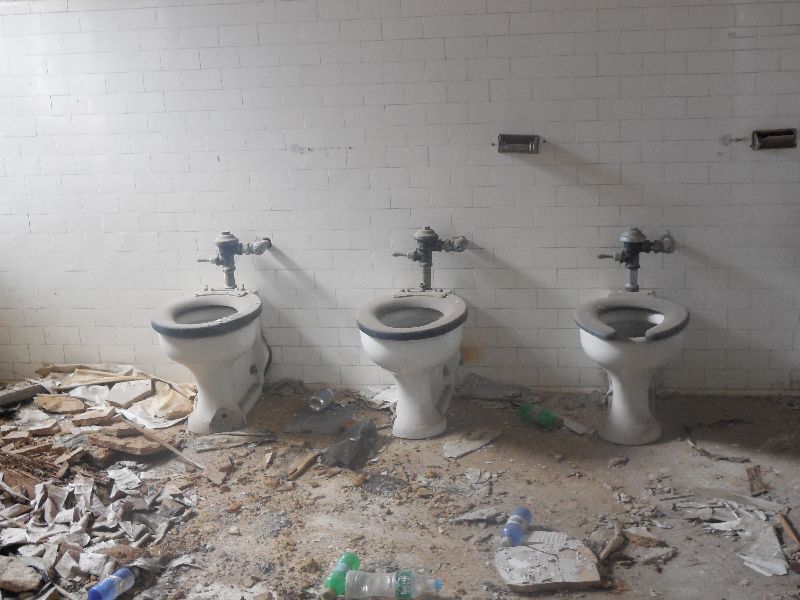
This screenshot has width=800, height=600. Identify the location of roll holder. [x=766, y=140].